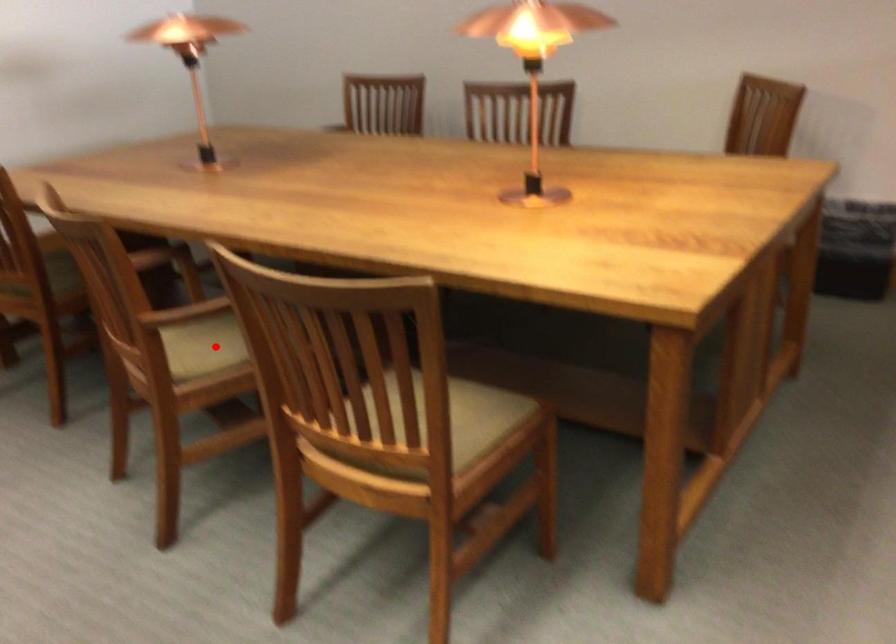
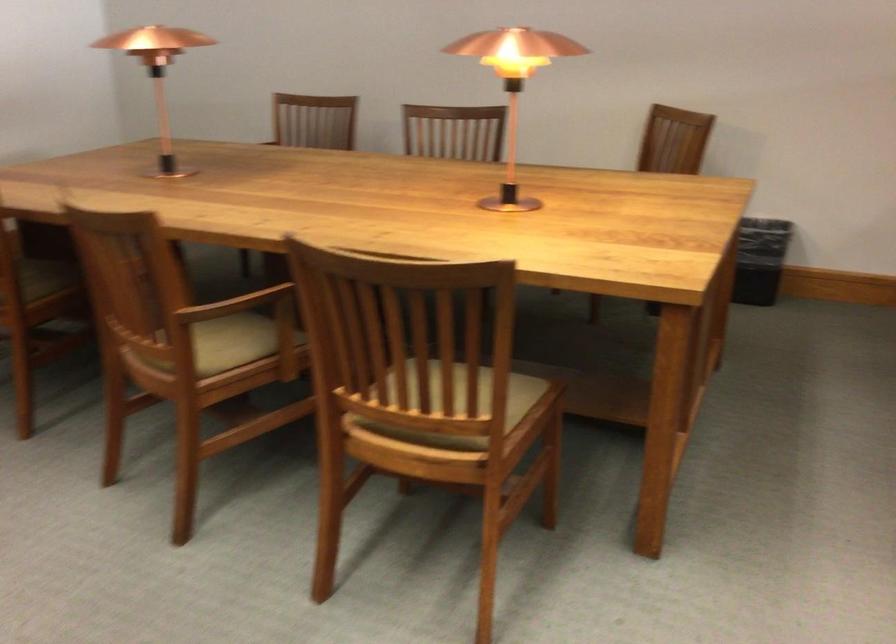
Find the pixel in the second image that matches the highlighted location in the first image.

(228, 343)